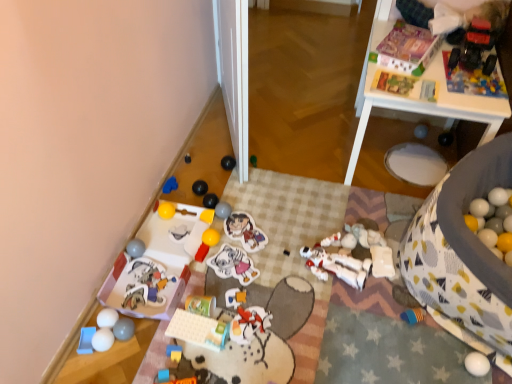
Find the location of a particular element. free space behind matte plastic sticker at center, the 20th toy when ordered from left to right is located at coordinates (250, 202).